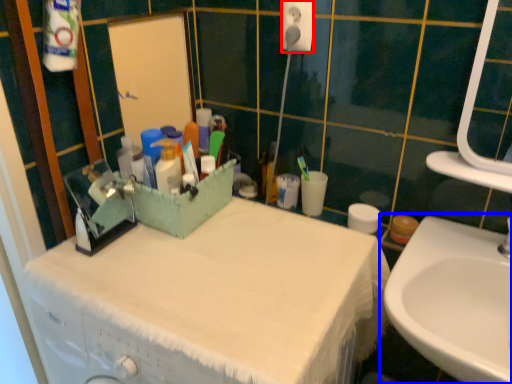
Question: Which of the following is the closest to the observer, electric outlet (highlighted by a red box) or sink (highlighted by a blue box)?

Choices:
 (A) electric outlet
 (B) sink

Answer: (B)